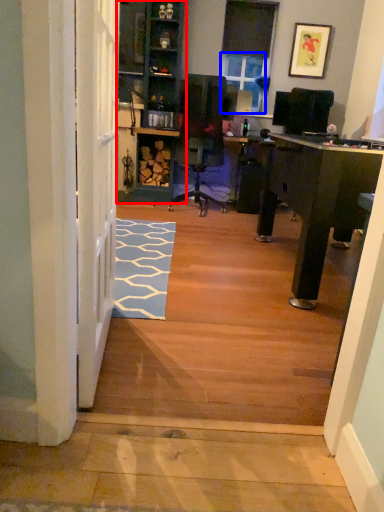
Question: Which point is further to the camera, bookshelf (highlighted by a red box) or window screen (highlighted by a blue box)?

Choices:
 (A) bookshelf
 (B) window screen

Answer: (B)